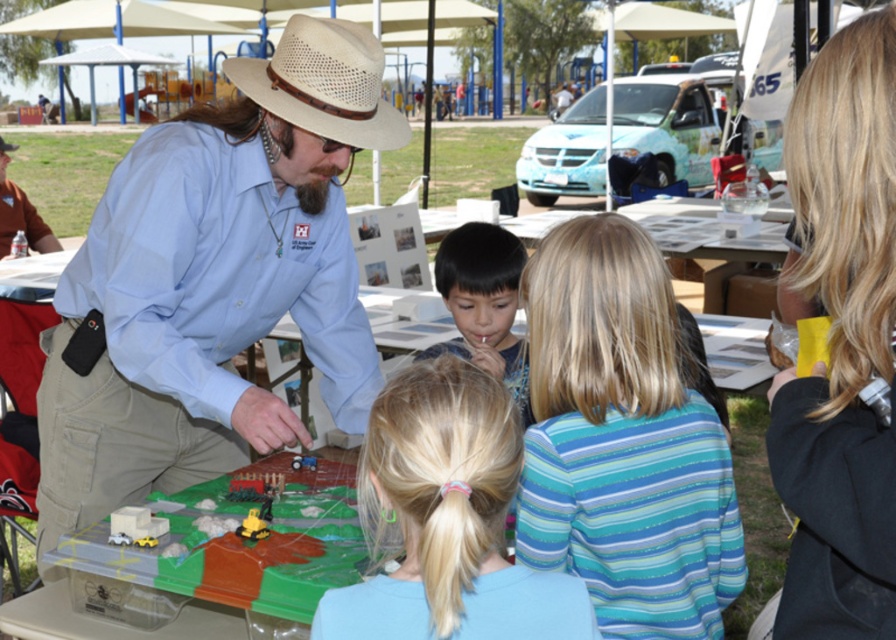
Question: Which of the following is the farthest from the observer?

Choices:
 (A) blonde hair at center
 (B) light blue shirt at center

Answer: (B)

Question: Considering the relative positions of light blue shirt at center and blonde hair at center in the image provided, where is light blue shirt at center located with respect to blonde hair at center?

Choices:
 (A) above
 (B) below

Answer: (A)

Question: Estimate the real-world distances between objects in this image. Which object is closer to the black matte shirt at center?

Choices:
 (A) blue striped shirt at center
 (B) light blue shirt at center
 (C) matte black phone at left
 (D) beige woven hat at center

Answer: (A)

Question: Is light blue shirt at center wider than blue striped shirt at center?

Choices:
 (A) yes
 (B) no

Answer: (A)

Question: Does light blue shirt at center have a smaller size compared to beige woven hat at center?

Choices:
 (A) no
 (B) yes

Answer: (A)

Question: Which object is farther from the camera taking this photo?

Choices:
 (A) beige woven hat at center
 (B) black matte shirt at center
 (C) light blue shirt at center
 (D) blonde hair at center

Answer: (B)